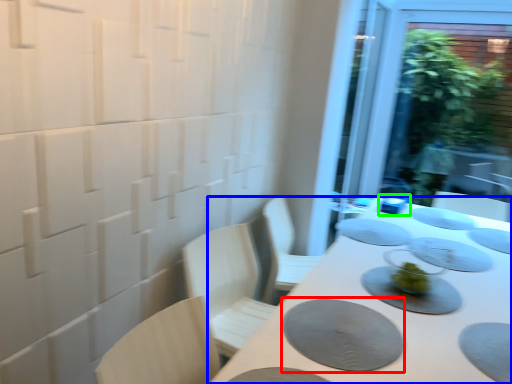
Question: Which is farther away from platter (highlighted by a red box)? table (highlighted by a blue box) or tableware (highlighted by a green box)?

Choices:
 (A) table
 (B) tableware

Answer: (B)